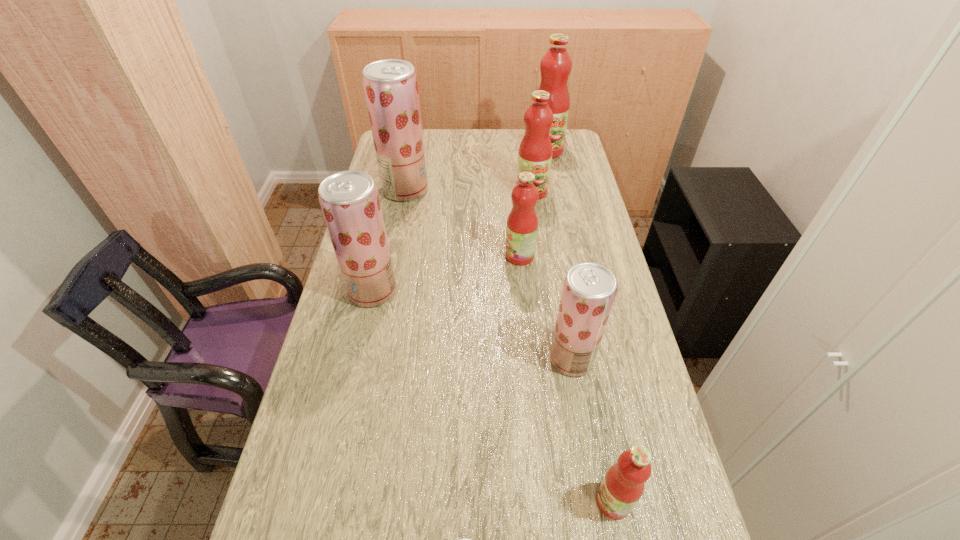
Identify which pink fruit juice is the second closest to the second nearest strawberry fruit juice. Please provide its 2D coordinates. Your answer should be formatted as a tuple, i.e. [(x, y)], where the tuple contains the x and y coordinates of a point satisfying the conditions above.

[(522, 223)]

You are a GUI agent. You are given a task and a screenshot of the screen. Output one action in this format:
    pyautogui.click(x=<x>, y=<y>)
    Task: Click on the third closest pink fruit juice to the farthest fruit juice
    This screenshot has width=960, height=540.
    Given the screenshot: What is the action you would take?
    pyautogui.click(x=623, y=485)